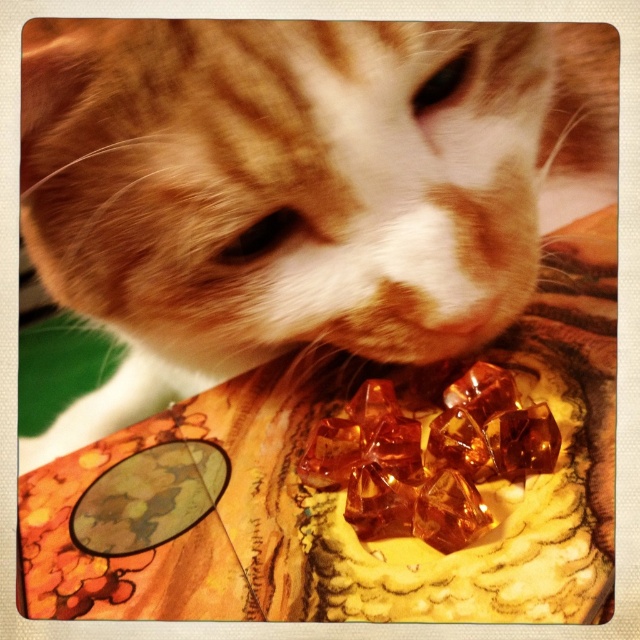
Based on the scene description, can the orange fur cat at center easily step over the translucent amber cubes at center without bending down?

The orange fur cat at center is much taller than the translucent amber cubes at center, so it can easily step over them without bending down.

What are the coordinates of the orange fur cat at center?

The coordinates of the orange fur cat at center are at point (x=298, y=188).

Consider the image. You are a photographer trying to capture the cat in the image. The cat is at point (x=298, y=188). If you want to focus on the cat, where should you aim your camera?

The point (x=298, y=188) corresponds to the orange fur cat at center, so you should aim your camera at that point to focus on the cat.